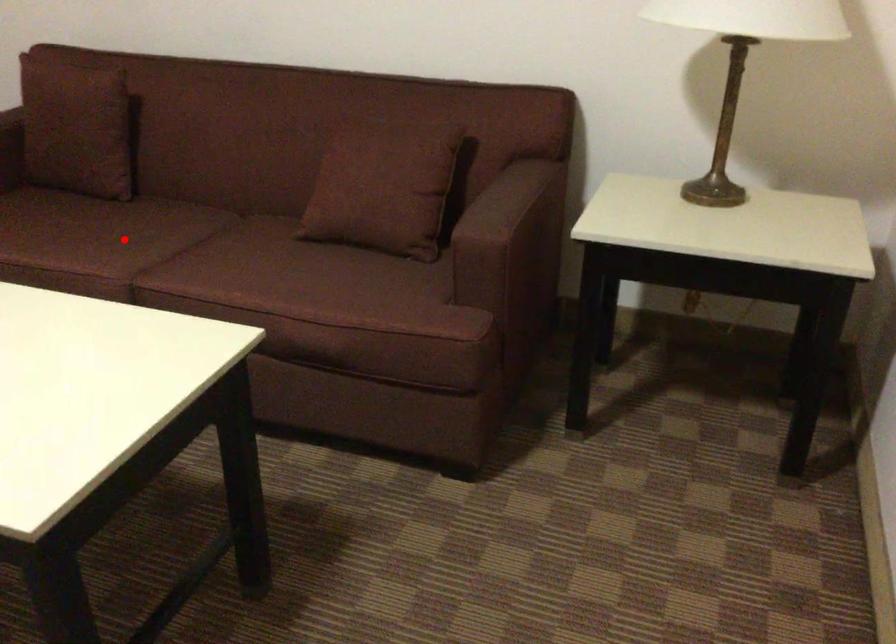
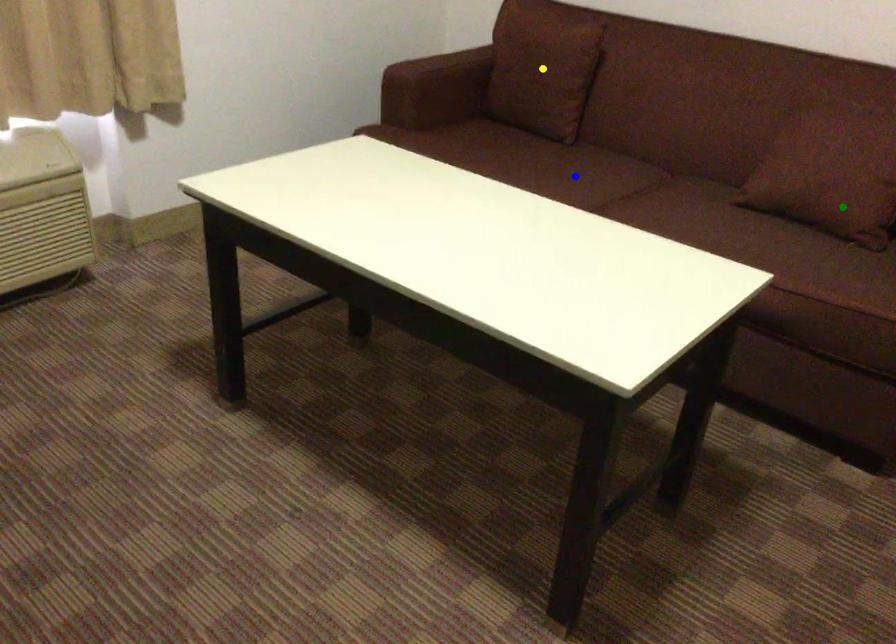
Question: I am providing you with two images of the same scene from different viewpoints. A red point is marked on the first image. You are given multiple points on the second image. Which point in image 2 is actually the same real-world point as the red point in image 1?

Choices:
 (A) blue point
 (B) yellow point
 (C) green point

Answer: (A)